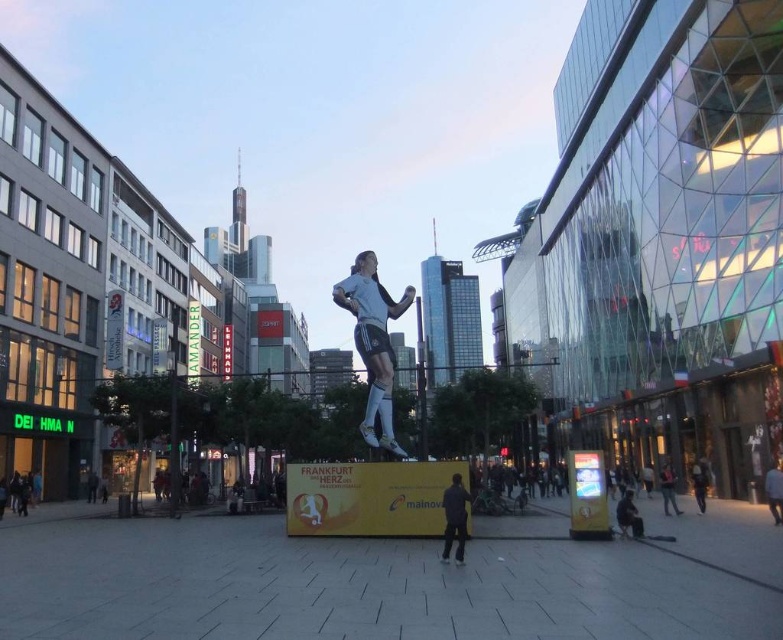
Between white matte soccer player at center and dark gray fabric jacket at lower center, which one is positioned higher?

white matte soccer player at center is higher up.

Does point (403, 300) come farther from viewer compared to point (456, 552)?

That is True.

Locate an element on the screen. white matte soccer player at center is located at coordinates (373, 342).

Can you confirm if dark gray fabric jacket at lower center is taller than green fabric jacket at center?

Incorrect, dark gray fabric jacket at lower center's height is not larger of green fabric jacket at center's.

Who is taller, dark gray fabric jacket at lower center or green fabric jacket at center?

green fabric jacket at center

The width and height of the screenshot is (783, 640). In order to click on dark gray fabric jacket at lower center in this screenshot , I will do `click(453, 518)`.

Consider the image. Between white matte soccer player at center and white jersey at center, which one has less height?

white jersey at center

Does white matte soccer player at center have a lesser height compared to white jersey at center?

No.

Image resolution: width=783 pixels, height=640 pixels. I want to click on white matte soccer player at center, so (x=373, y=342).